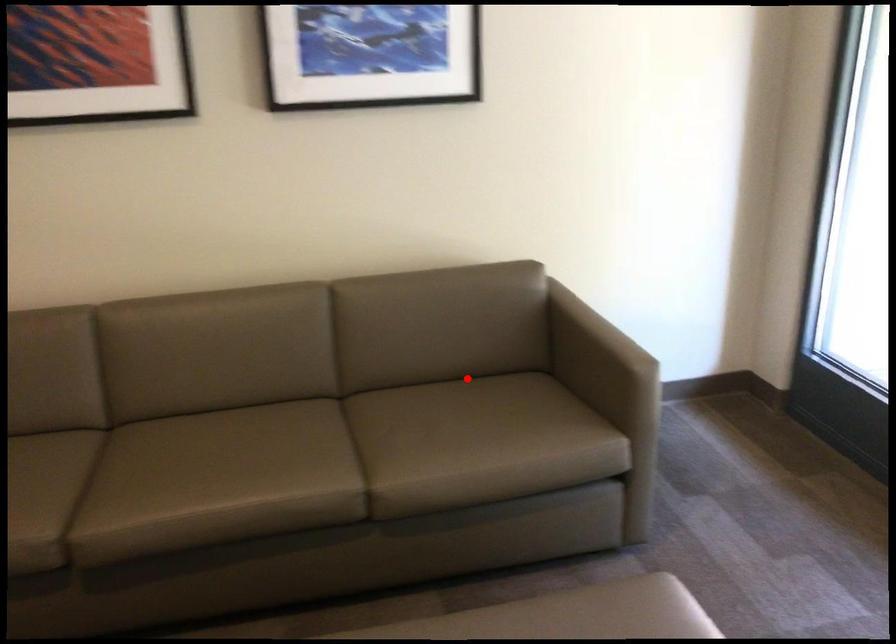
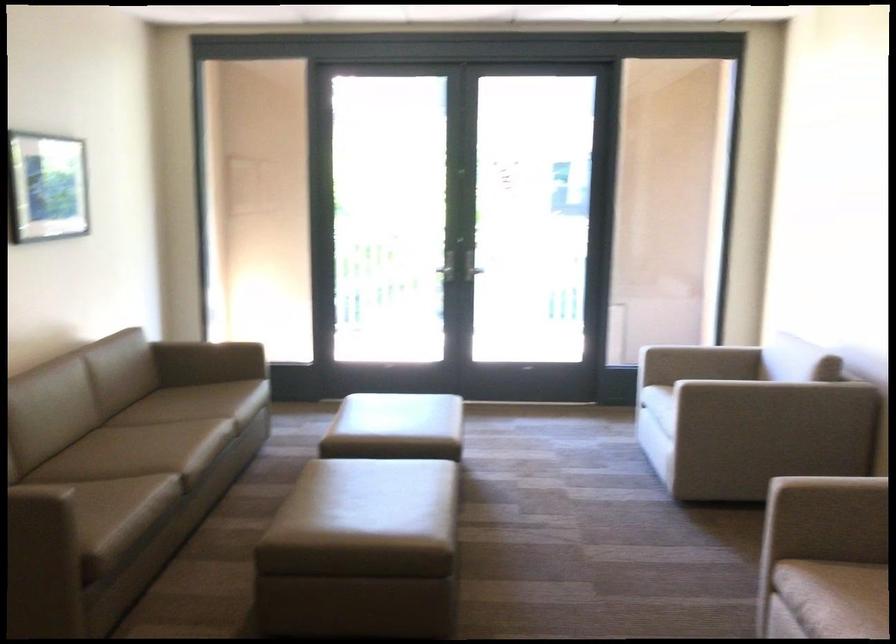
The point at the highlighted location is marked in the first image. Where is the corresponding point in the second image?

(122, 399)